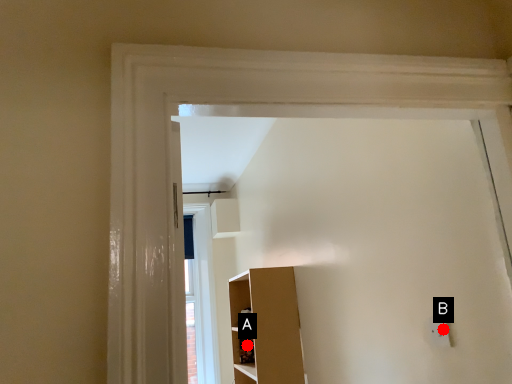
Question: Two points are circled on the image, labeled by A and B beside each circle. Which of the following is the farthest from the observer?

Choices:
 (A) A is further
 (B) B is further

Answer: (A)